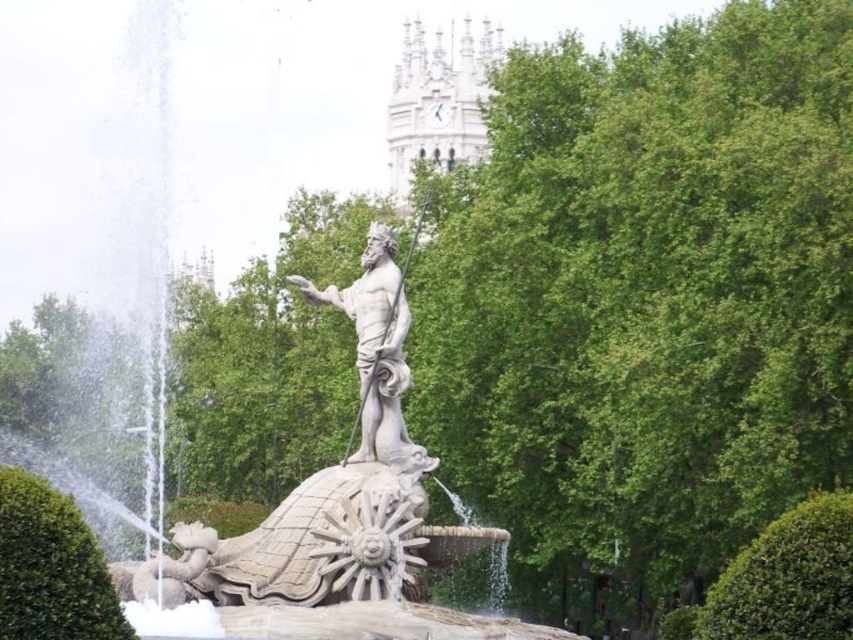
You are standing in front of the fountain and want to place a small flower pot at point (432, 109) and another flower pot at point (370, 452). Which flower pot will be closer to you?

The flower pot at point (432, 109) will be closer to you because it is further to the viewer than point (370, 452).

You are standing in front of the fountain and want to take a photo of the white stone statue at center with the green leafy hedge at lower right in the background. Which direction should you face to ensure the hedge is behind the statue in your photo?

You should face to the left of the white stone statue at center because the green leafy hedge at lower right is located to the right of the statue. By facing left, the hedge will appear behind the statue in your photo.